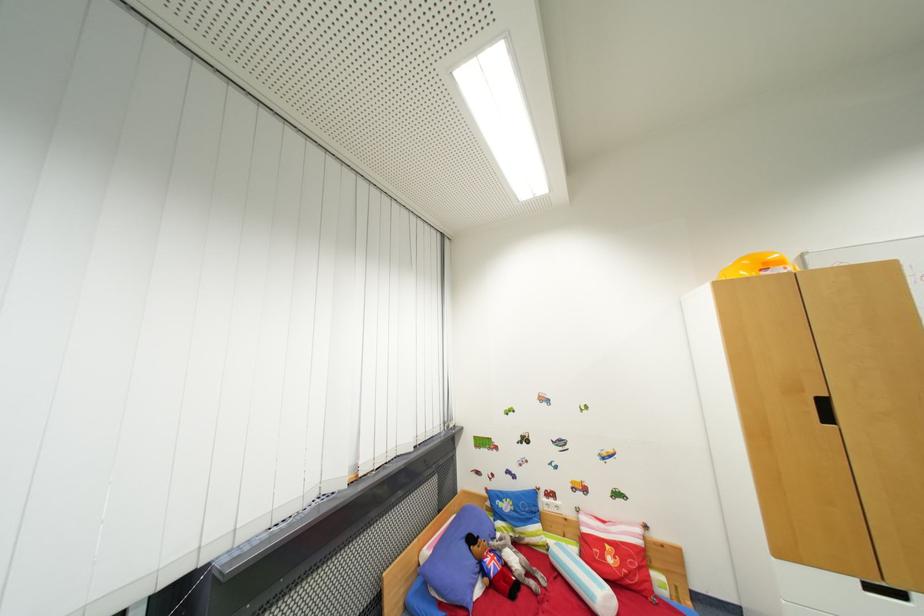
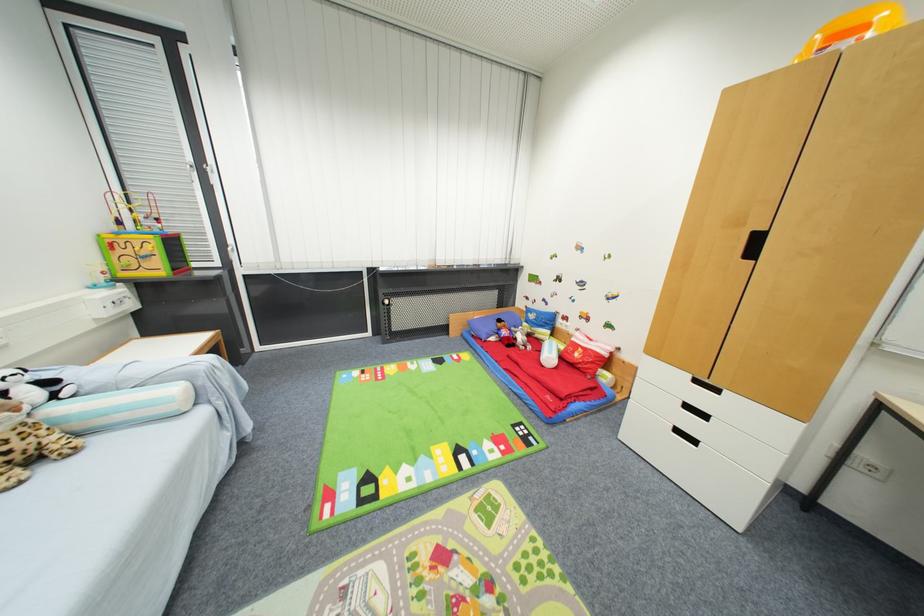
The point at [864,584] is marked in the first image. Where is the corresponding point in the second image?

(695, 378)